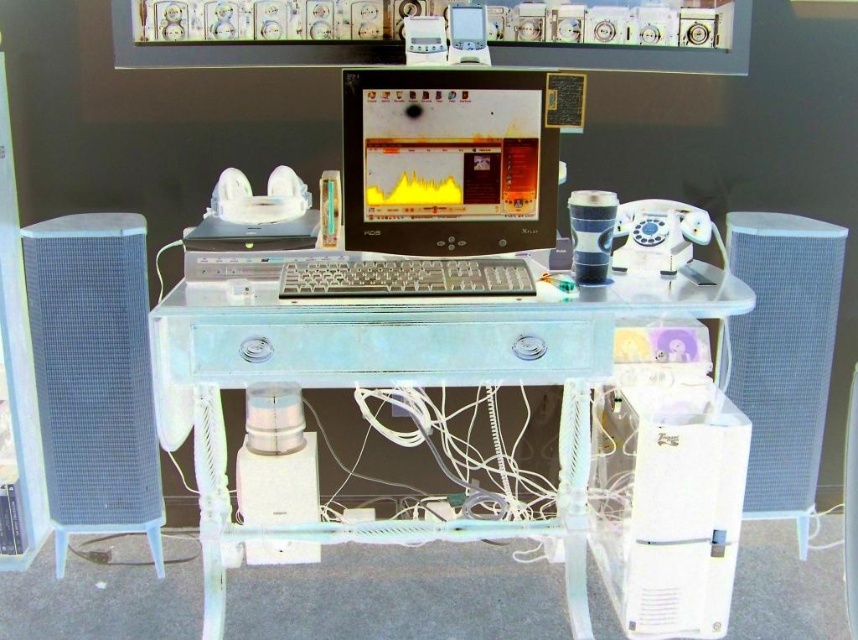
You are organizing cables for the workstation and need to route them from the clear acrylic desk at center to the white mesh speaker at left. Considering their positions, where should you place the cable ties to secure them?

The clear acrylic desk at center is positioned under the white mesh speaker at left, so you should place the cable ties near the base of the white mesh speaker at left to secure the cables running from the desk upwards.

From the picture: You are setting up a new device and need to place it between the white mesh speaker at left and the clear plastic keyboard at center. The device requires at least 24 inches of space. Can you fit it there?

The white mesh speaker at left is 26.24 inches away from the clear plastic keyboard at center, so yes, you can fit the device between them as the distance is sufficient.

You are setting up a new monitor on the desk and need to place it between the white mesh speaker at left and the clear plastic keyboard at center. Given that the speaker is larger than the keyboard, where should you position the monitor to ensure it fits properly?

Since the white mesh speaker at left is larger than the clear plastic keyboard at center, you should place the monitor closer to the speaker to accommodate its size, ensuring there is enough space between them for the monitor to fit properly.